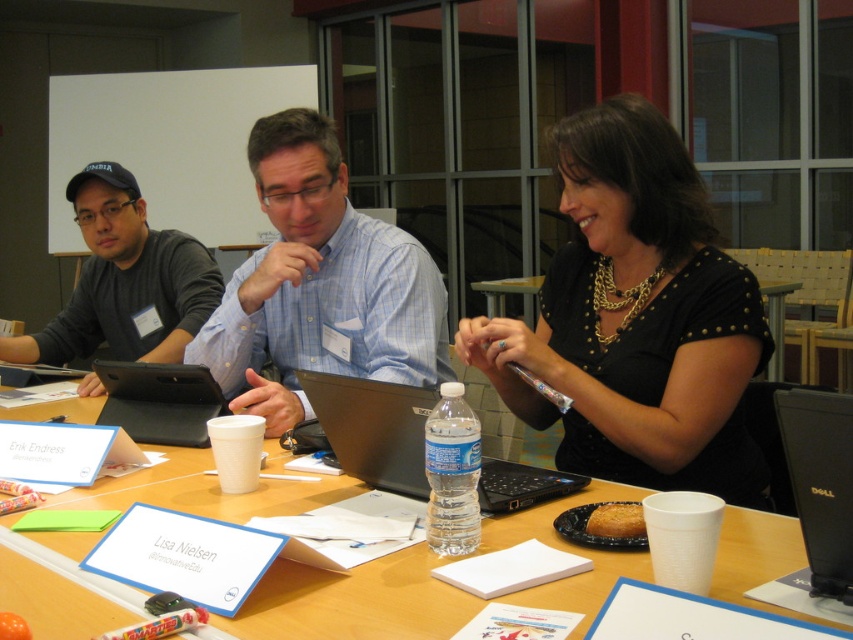
Between point (395, 358) and point (498, 307), which one is positioned in front?

Point (395, 358)

Between blue plaid shirt at center and black matte table at center, which one appears on the right side from the viewer's perspective?

Positioned to the right is black matte table at center.

Where is `blue plaid shirt at center`? This screenshot has height=640, width=853. blue plaid shirt at center is located at coordinates pos(318,285).

The height and width of the screenshot is (640, 853). I want to click on blue plaid shirt at center, so click(318, 285).

Does wooden table at center lie in front of matte black shirt at left?

Yes, wooden table at center is in front of matte black shirt at left.

Which is behind, point (363, 579) or point (135, 204)?

The point (135, 204) is more distant.

Locate an element on the screen. The height and width of the screenshot is (640, 853). wooden table at center is located at coordinates (354, 602).

The image size is (853, 640). Identify the location of wooden table at center. (354, 602).

Image resolution: width=853 pixels, height=640 pixels. What do you see at coordinates (354, 602) in the screenshot?
I see `wooden table at center` at bounding box center [354, 602].

Can you confirm if wooden table at center is wider than black plastic laptop at center?

Indeed, wooden table at center has a greater width compared to black plastic laptop at center.

I want to click on wooden table at center, so click(354, 602).